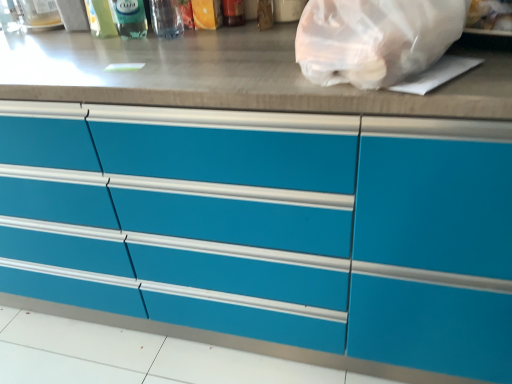
At what (x,y) coordinates should I click in order to perform the action: click on vacant area that lies to the right of transparent plastic bottle at upper center, marked as the 1th bottle in a right-to-left arrangement. Please return your answer as a coordinate pair (x, y). The width and height of the screenshot is (512, 384). Looking at the image, I should click on (219, 36).